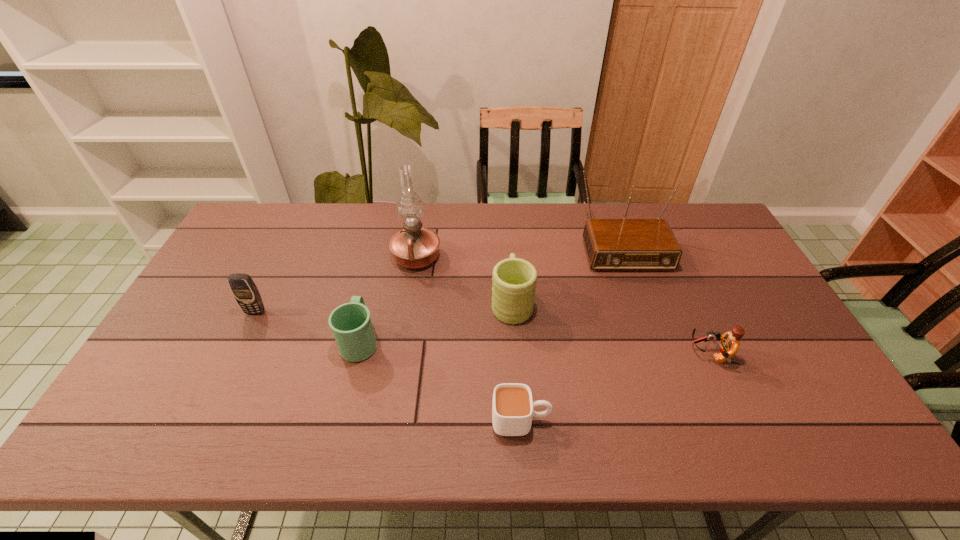
Where is `vacant area situated 0.400m on the side with the handle of the shortest object`? The width and height of the screenshot is (960, 540). vacant area situated 0.400m on the side with the handle of the shortest object is located at coordinates (x=720, y=420).

The image size is (960, 540). I want to click on oil lamp at the far edge, so click(415, 247).

This screenshot has width=960, height=540. Identify the location of radio_receiver that is at the far edge. (611, 244).

Find the location of `object that is positioned at the near edge`. object that is positioned at the near edge is located at coordinates (512, 408).

At what (x,y) coordinates should I click in order to perform the action: click on free region at the far edge of the desktop. Please return your answer as a coordinate pair (x, y). The width and height of the screenshot is (960, 540). Looking at the image, I should click on (448, 213).

Identify the location of vacant point at the near edge. The image size is (960, 540). (568, 414).

What are the coordinates of `vacant space at the far left corner` in the screenshot? It's located at (257, 234).

Image resolution: width=960 pixels, height=540 pixels. I want to click on free space at the far right corner, so click(682, 209).

I want to click on vacant point at the near right corner, so click(840, 419).

Find the location of a particular element. vacant space in between the Lego and the radio_receiver is located at coordinates (664, 297).